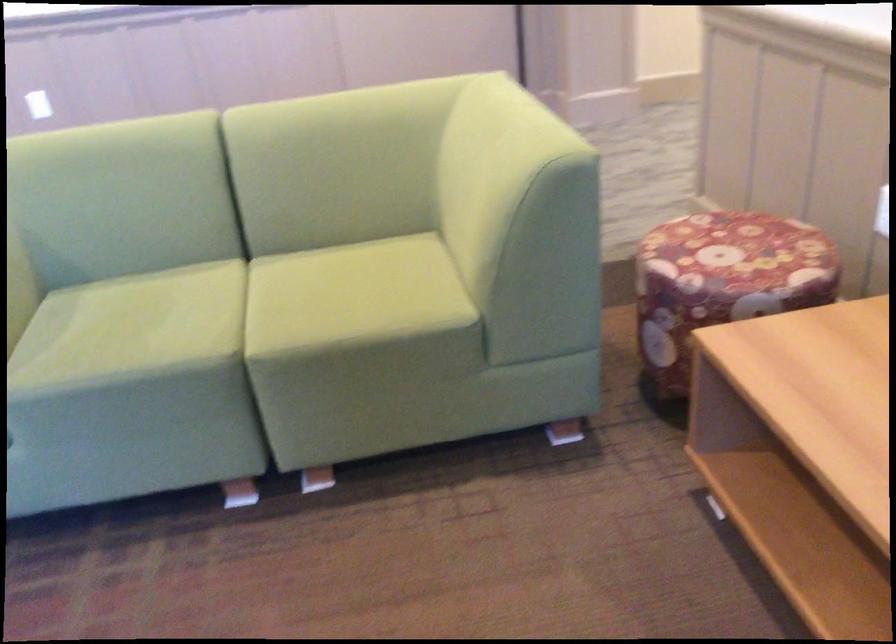
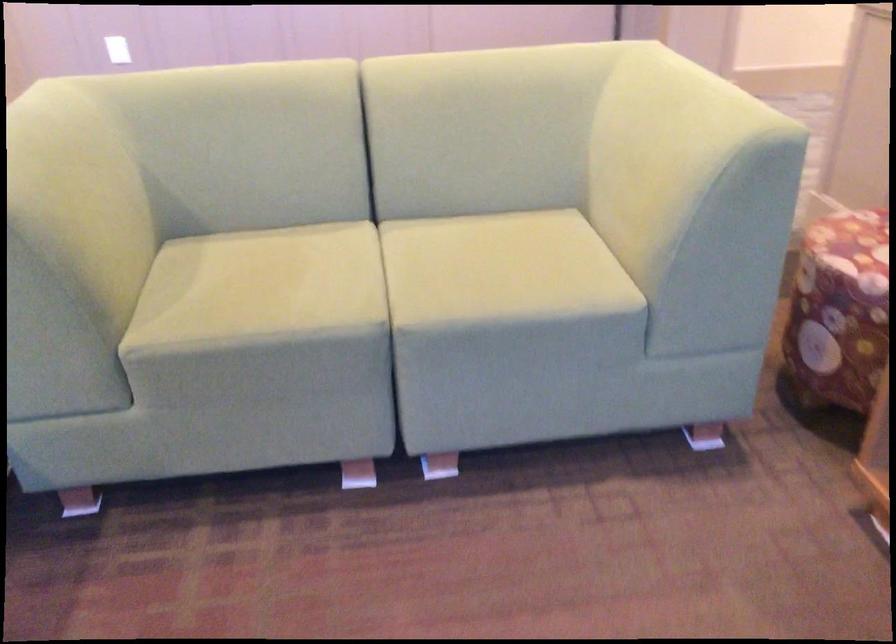
Locate, in the second image, the point that corresponds to pixel 341 290 in the first image.

(488, 261)